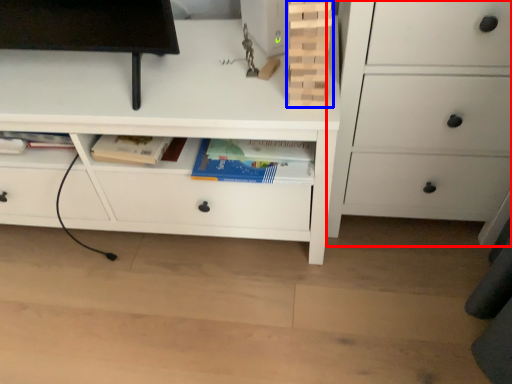
Question: Among these objects, which one is nearest to the camera, chest of drawers (highlighted by a red box) or book (highlighted by a blue box)?

Choices:
 (A) chest of drawers
 (B) book

Answer: (A)